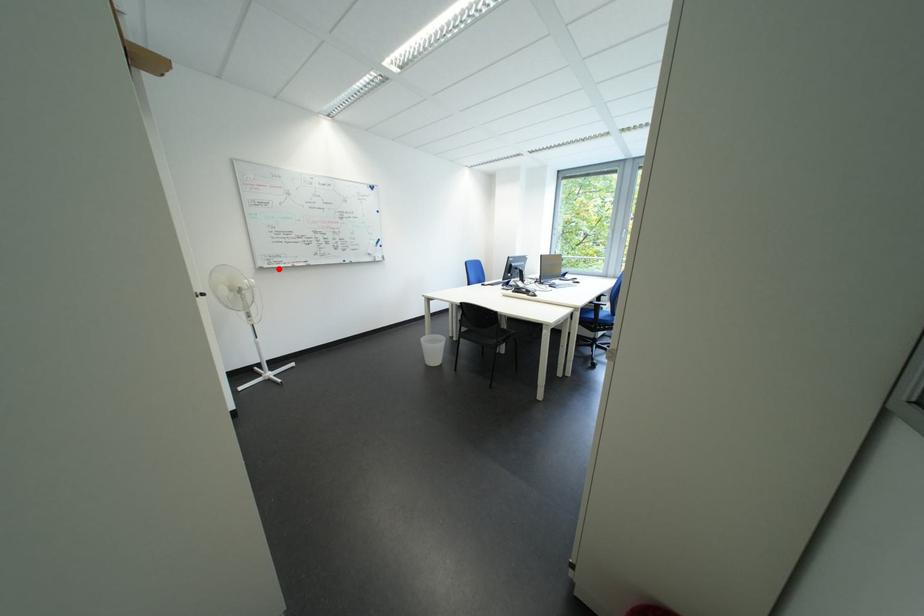
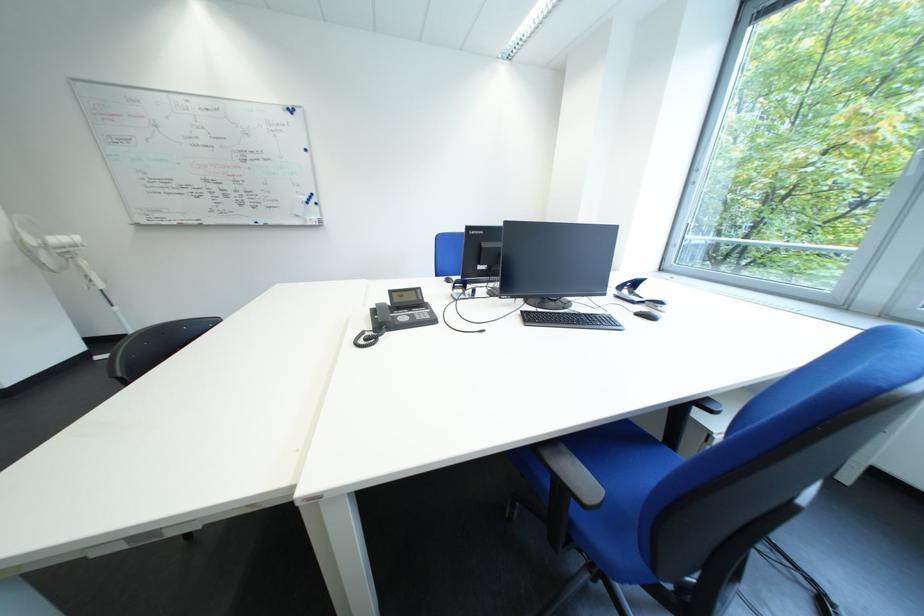
Where in the second image is the point corresponding to the highlighted location from the first image?

(157, 225)